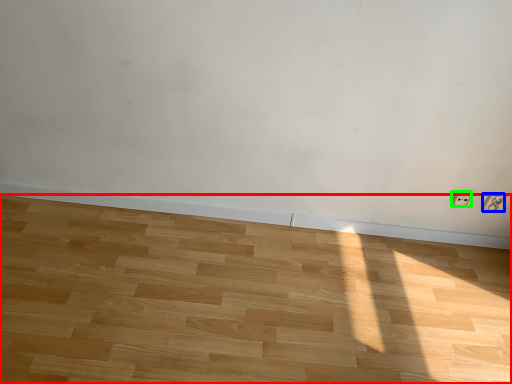
Question: Which object is the closest to the hardwood (highlighted by a red box)? Choose among these: electric outlet (highlighted by a blue box) or electric outlet (highlighted by a green box).

Choices:
 (A) electric outlet
 (B) electric outlet

Answer: (B)